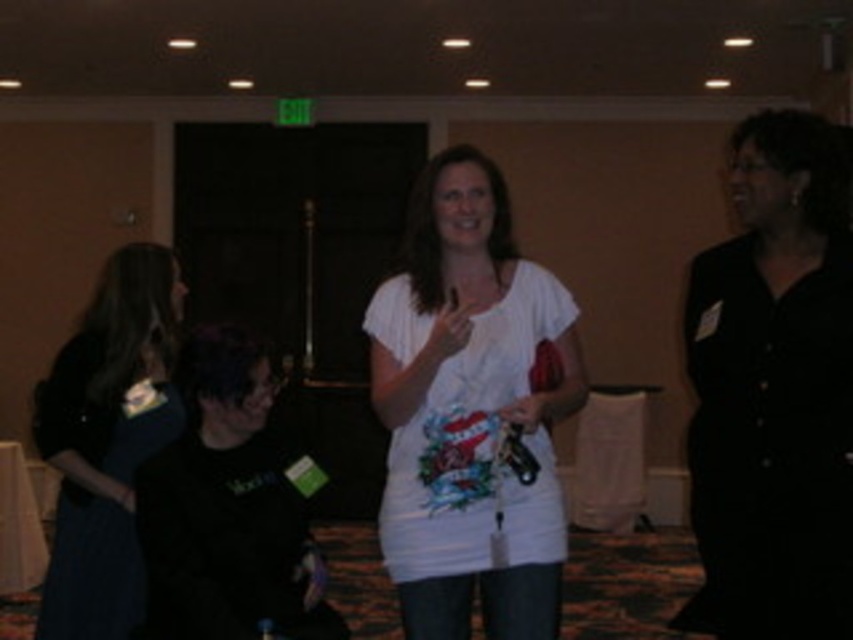
You are planning to take a photo of the two dresses in the scene. Which dress, the black satin dress at right or the dark blue dress at left, is positioned higher from the ground?

The black satin dress at right is above the dark blue dress at left, so the black satin dress at right is positioned higher from the ground.